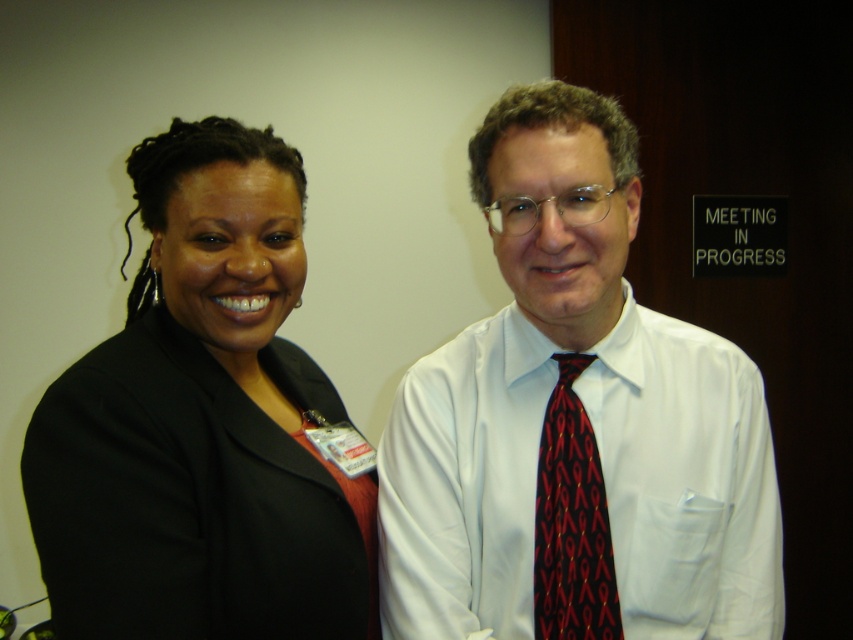
You are organizing a photo shoot and need to arrange two props. The black fabric jacket at left and the red silk tie at center are placed in the image. Which prop is located more to the left?

The black fabric jacket at left is positioned on the left side of the red silk tie at center, so it is more to the left.

You are standing in the professional setting shown in the image. You need to locate the white shirt and tie at center. According to the coordinates provided, where exactly is this person positioned relative to the image frame?

The white shirt and tie at center is located at point coordinates of 0.662 on the x axis and 0.675 on the y axis.

You are a photographer standing 5 feet away from the two individuals in the image. You need to capture a closeup shot of both the white shirt and tie at center and the red silk tie at center in a single frame. Given the distance between them, will you be able to fit both into the camera frame if your camera has a maximum field of view of 4 inches?

The white shirt and tie at center is 4.12 inches away from the red silk tie at center. Since the distance between them exceeds the camera frame field of view of 4 inches, you will not be able to capture both in a single frame.